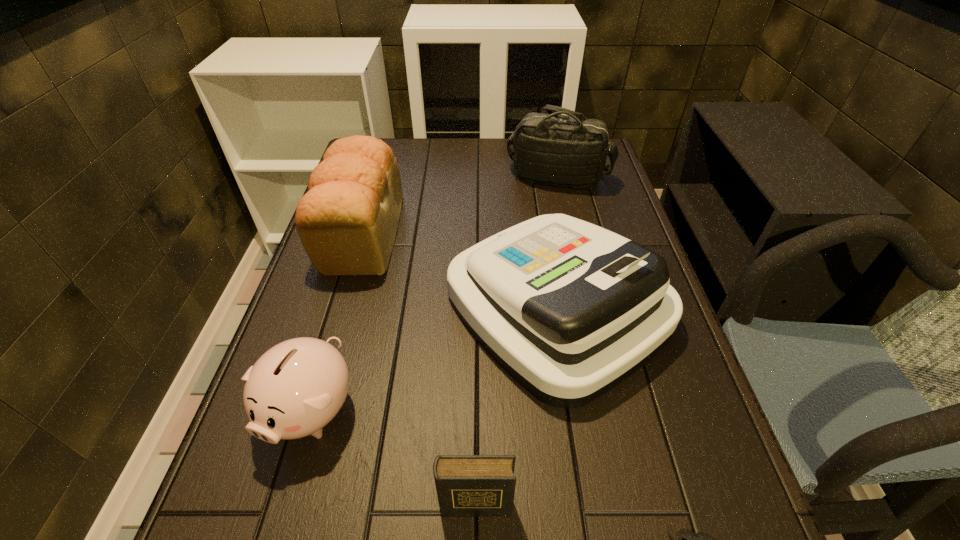
This screenshot has height=540, width=960. Identify the location of vacant area that lies between the piggy bank and the diary. (393, 457).

Identify the location of object that stands as the fourth closest to the shortest object. pos(347,222).

Select which object is the third closest to the fifth farthest object. Please provide its 2D coordinates. Your answer should be formatted as a tuple, i.e. [(x, y)], where the tuple contains the x and y coordinates of a point satisfying the conditions above.

[(690, 539)]